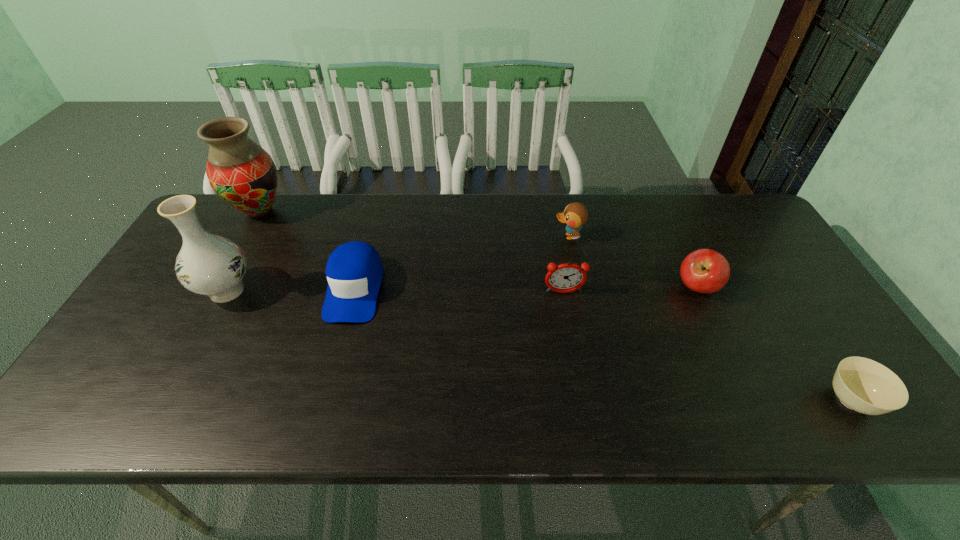
Where is `free space located on the front-facing side of the duck`? The width and height of the screenshot is (960, 540). free space located on the front-facing side of the duck is located at coordinates (475, 237).

Where is `vacant space located 0.400m on the front-facing side of the duck`? The height and width of the screenshot is (540, 960). vacant space located 0.400m on the front-facing side of the duck is located at coordinates (423, 237).

Find the location of a particular element. The image size is (960, 540). vacant space situated on the front-facing side of the duck is located at coordinates (426, 237).

Where is `vacant space located 0.270m on the front of the sixth object from left to right`? Image resolution: width=960 pixels, height=540 pixels. vacant space located 0.270m on the front of the sixth object from left to right is located at coordinates (748, 396).

I want to click on free space located on the front-facing side of the alarm clock, so click(567, 316).

Identify the location of free spot located 0.090m on the front-facing side of the third object from left to right. The width and height of the screenshot is (960, 540). (337, 355).

Where is `free region located on the left of the nearest object`? free region located on the left of the nearest object is located at coordinates (732, 401).

The image size is (960, 540). I want to click on vase that is at the far edge, so click(243, 174).

In order to click on duck positioned at the far edge in this screenshot , I will do `click(575, 215)`.

Find the location of `object at the near edge`. object at the near edge is located at coordinates (861, 384).